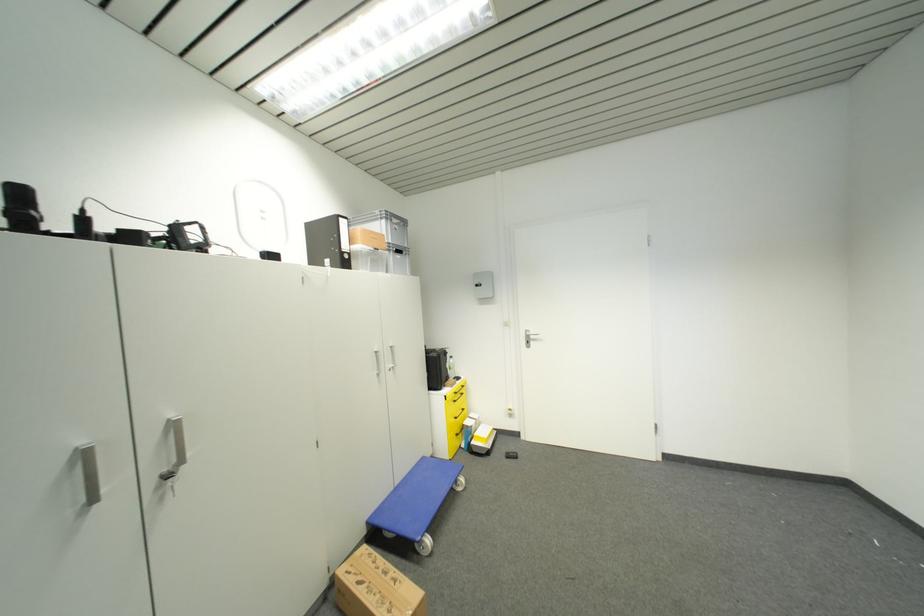
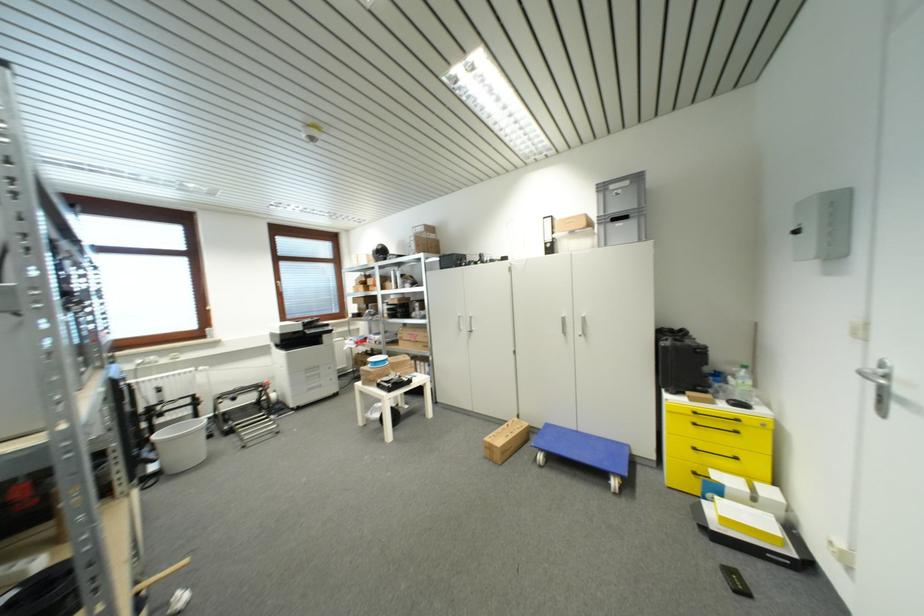
Where in the second image is the point corresponding to [444,359] from the first image?

(670, 351)